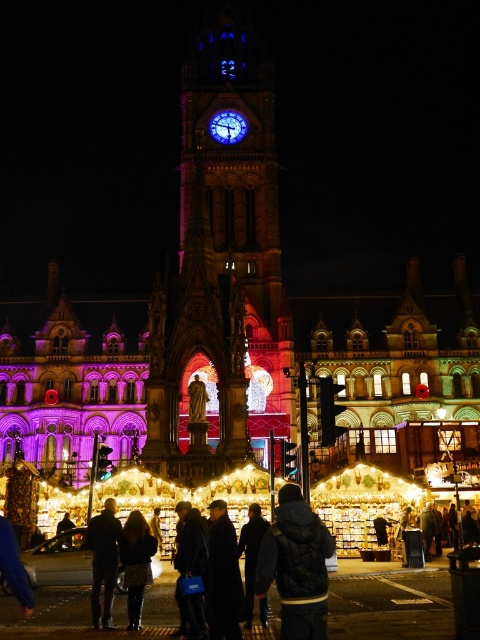
Question: Does dark brown leather boots at lower center appear on the left side of dark blue jacket at center?

Choices:
 (A) no
 (B) yes

Answer: (B)

Question: Does dark blue leather jacket at lower left have a greater width compared to dark blue jacket at center?

Choices:
 (A) no
 (B) yes

Answer: (B)

Question: Among these objects, which one is nearest to the camera?

Choices:
 (A) dark blue leather jacket at lower left
 (B) dark blue jacket at center
 (C) dark gray jacket at center
 (D) dark wool coat at center

Answer: (C)

Question: Which object is the closest to the dark brown leather boots at lower center?

Choices:
 (A) dark gray jacket at center
 (B) dark blue leather jacket at lower left
 (C) dark wool coat at center

Answer: (B)

Question: Which point is farther from the camera taking this photo?

Choices:
 (A) (296, 536)
 (B) (211, 522)

Answer: (B)

Question: Does brick clock tower at center have a larger size compared to dark blue jacket at center?

Choices:
 (A) no
 (B) yes

Answer: (B)